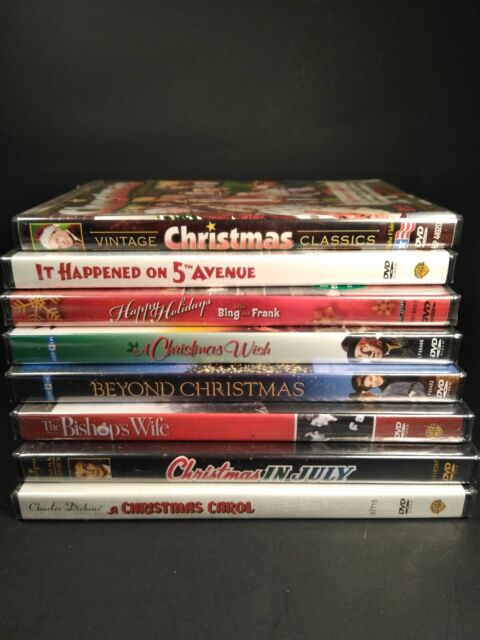
At what (x,y) coordinates should I click in order to perform the action: click on dvd case. Please return your answer as a coordinate pair (x, y). The width and height of the screenshot is (480, 640). Looking at the image, I should click on (214, 225), (233, 275), (241, 310), (225, 346), (272, 385), (257, 427), (259, 470), (252, 502).